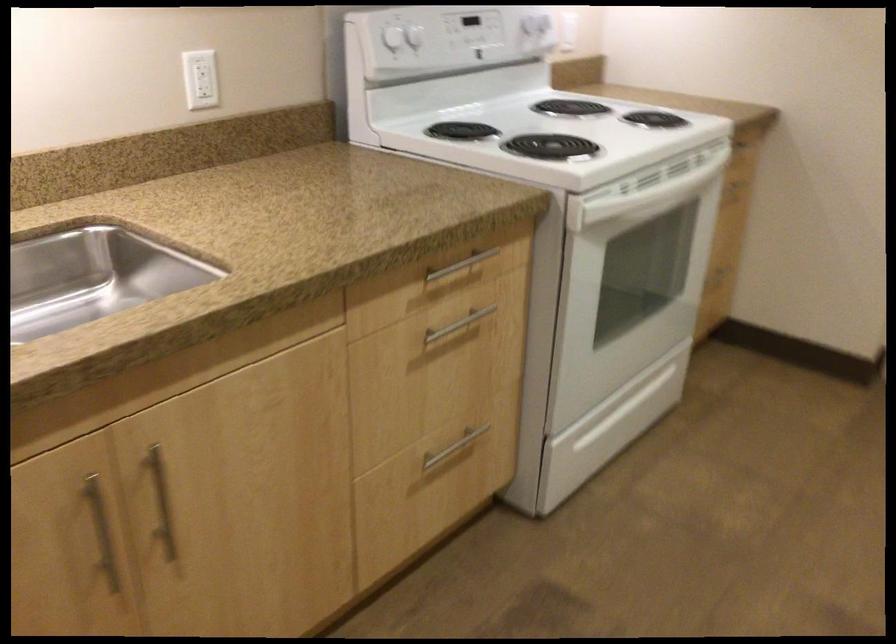
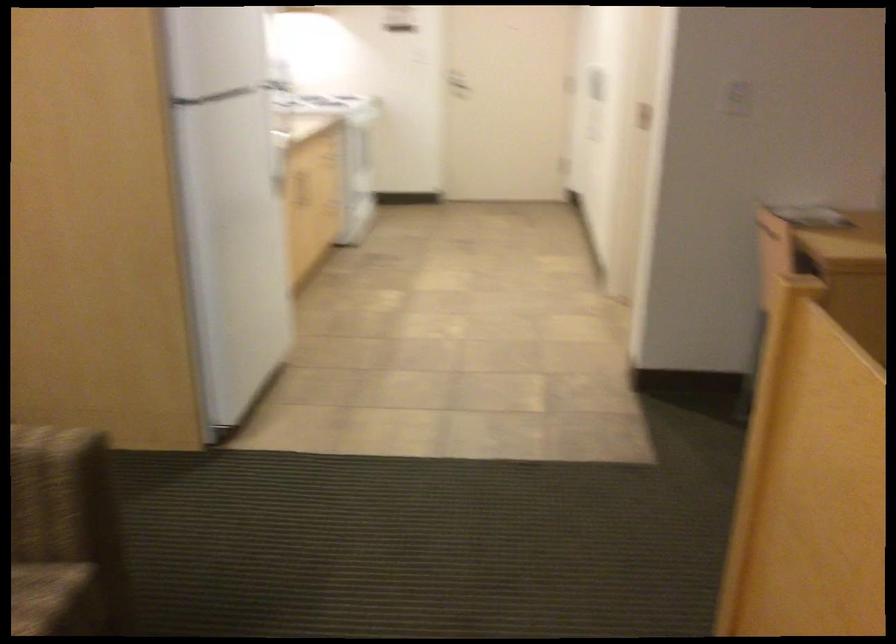
Question: I am providing you with two images of the same scene from different viewpoints. After the viewpoint changes to image2, which objects are now occluded?

Choices:
 (A) white headphones
 (B) door handle
 (C) wooden cabinet handle
 (D) white oven handle

Answer: (D)